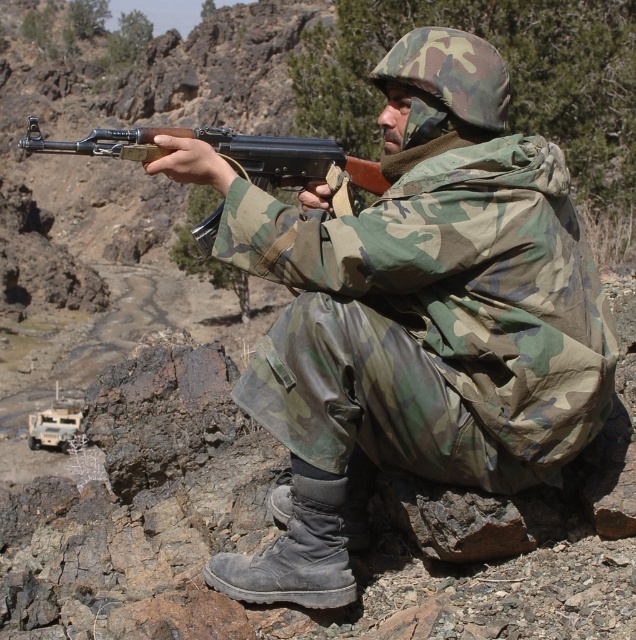
Question: Among these points, which one is nearest to the camera?

Choices:
 (A) (343, 230)
 (B) (567, 609)

Answer: (B)

Question: In this image, where is camo fabric uniform at center located relative to matte black shotgun at center?

Choices:
 (A) above
 (B) below

Answer: (B)

Question: Which is nearer to the matte black shotgun at center?

Choices:
 (A) rough textured rock at center
 (B) camo fabric uniform at center

Answer: (B)

Question: Can you confirm if camo fabric uniform at center is positioned to the left of matte black shotgun at center?

Choices:
 (A) no
 (B) yes

Answer: (A)

Question: Which point is farther to the camera?

Choices:
 (A) rough textured rock at center
 (B) matte black shotgun at center
 (C) camo fabric uniform at center

Answer: (B)

Question: Is rough textured rock at center to the right of matte black shotgun at center from the viewer's perspective?

Choices:
 (A) yes
 (B) no

Answer: (A)